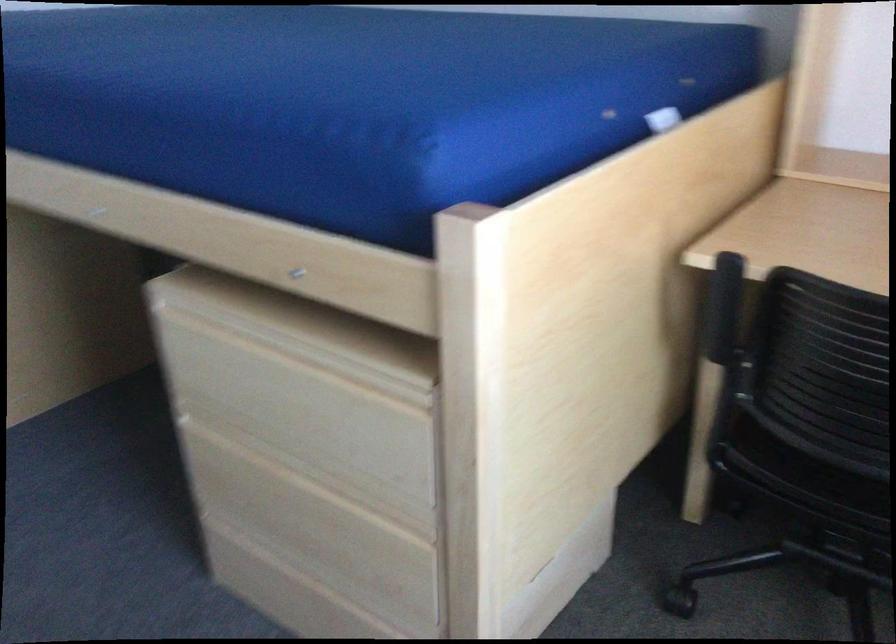
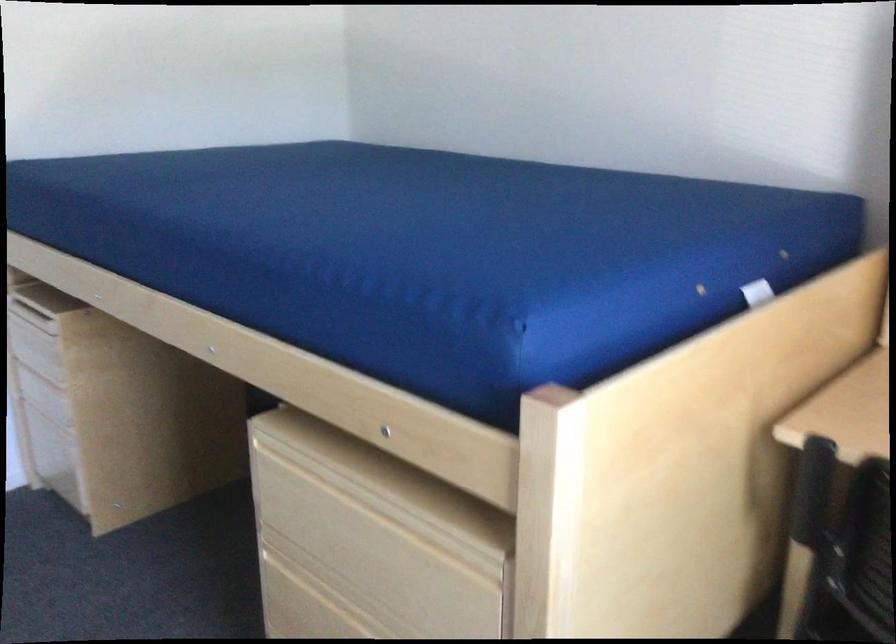
Which direction would the cameraman need to move to produce the second image?

The movement direction of the cameraman is right, backward.